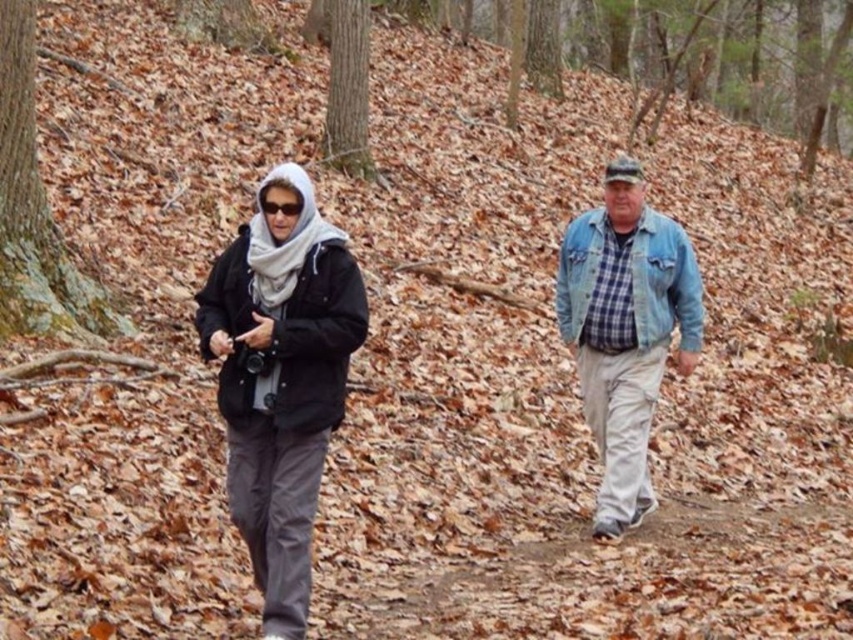
Question: From the image, what is the correct spatial relationship of black matte jacket at left in relation to denim jacket at right?

Choices:
 (A) left
 (B) right

Answer: (A)

Question: In this image, where is black matte jacket at left located relative to denim jacket at right?

Choices:
 (A) right
 (B) left

Answer: (B)

Question: Is black matte jacket at center to the right of denim jacket at right from the viewer's perspective?

Choices:
 (A) yes
 (B) no

Answer: (A)

Question: Among these points, which one is nearest to the camera?

Choices:
 (A) pos(250,410)
 (B) pos(289,177)
 (C) pos(640,371)

Answer: (B)

Question: Which object is positioned closest to the denim jacket at right?

Choices:
 (A) black matte jacket at center
 (B) black matte jacket at left

Answer: (A)

Question: Estimate the real-world distances between objects in this image. Which object is farther from the denim jacket at right?

Choices:
 (A) black matte jacket at left
 (B) black matte jacket at center

Answer: (A)